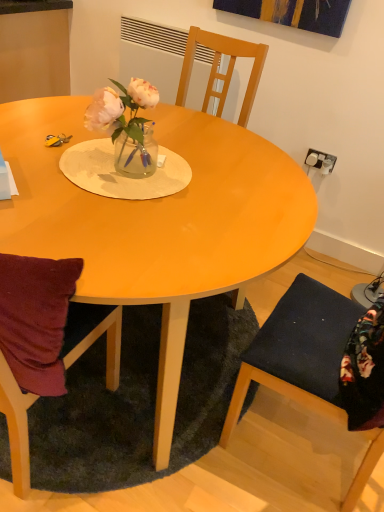
You are a GUI agent. You are given a task and a screenshot of the screen. Output one action in this format:
    pyautogui.click(x=<x>, y=<y>)
    Task: Click on the vacant space underneath translucent glass vase at center (from a real-world perspective)
    The image size is (384, 512).
    Given the screenshot: What is the action you would take?
    pyautogui.click(x=130, y=169)